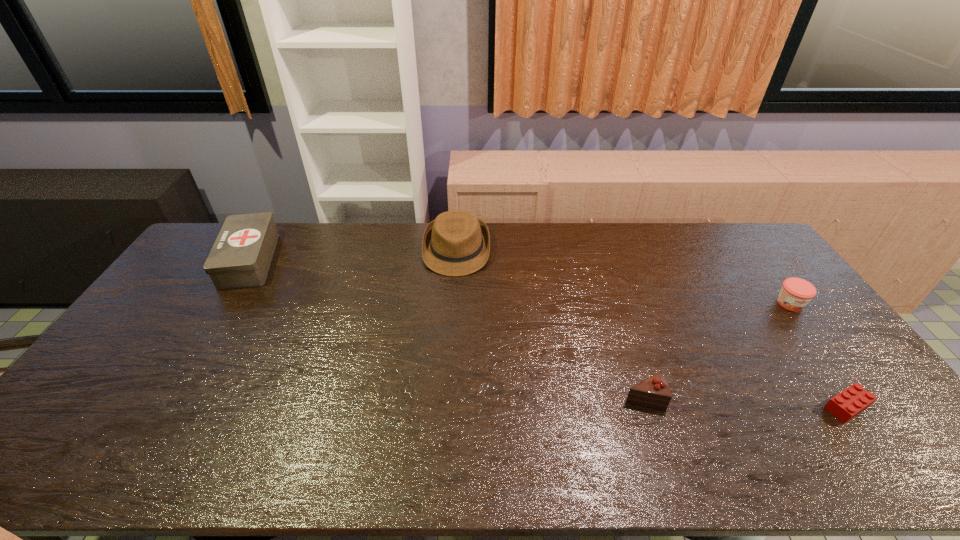
Find the location of a particular element. The height and width of the screenshot is (540, 960). vacant space that is in between the fedora and the Lego is located at coordinates (652, 328).

What are the coordinates of `free space between the first-aid kit and the Lego` in the screenshot? It's located at (548, 333).

Locate an element on the screen. The height and width of the screenshot is (540, 960). blank region between the Lego and the jam is located at coordinates (818, 355).

Find the location of a particular element. This screenshot has height=540, width=960. free space that is in between the third farthest object and the third object from left to right is located at coordinates (717, 350).

At what (x,y) coordinates should I click in order to perform the action: click on vacant region between the shortest object and the jam. Please return your answer as a coordinate pair (x, y). The image size is (960, 540). Looking at the image, I should click on (818, 355).

The image size is (960, 540). In order to click on free area in between the Lego and the jam in this screenshot , I will do `click(818, 355)`.

You are a GUI agent. You are given a task and a screenshot of the screen. Output one action in this format:
    pyautogui.click(x=<x>, y=<y>)
    Task: Click on the vacant space that's between the third farthest object and the fourth object from right to left
    
    Given the screenshot: What is the action you would take?
    pyautogui.click(x=623, y=276)

The height and width of the screenshot is (540, 960). Find the location of `vacant space that is in between the fedora and the leftmost object`. vacant space that is in between the fedora and the leftmost object is located at coordinates (353, 255).

Locate an element on the screen. Image resolution: width=960 pixels, height=540 pixels. unoccupied position between the third farthest object and the Lego is located at coordinates (818, 355).

You are a GUI agent. You are given a task and a screenshot of the screen. Output one action in this format:
    pyautogui.click(x=<x>, y=<y>)
    Task: Click on the vacant area that lies between the third farthest object and the second object from left to right
    
    Given the screenshot: What is the action you would take?
    pyautogui.click(x=623, y=276)